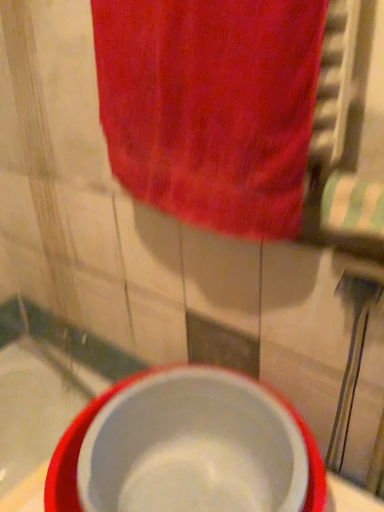
Question: Considering the relative sizes of white plastic basin at center and white glossy bath at lower left in the image provided, is white plastic basin at center thinner than white glossy bath at lower left?

Choices:
 (A) no
 (B) yes

Answer: (A)

Question: From the image's perspective, is white plastic basin at center below white glossy bath at lower left?

Choices:
 (A) yes
 (B) no

Answer: (A)

Question: From a real-world perspective, is white plastic basin at center physically above white glossy bath at lower left?

Choices:
 (A) yes
 (B) no

Answer: (A)

Question: Can you confirm if white plastic basin at center is positioned to the left of white glossy bath at lower left?

Choices:
 (A) yes
 (B) no

Answer: (B)

Question: Is white plastic basin at center wider than white glossy bath at lower left?

Choices:
 (A) no
 (B) yes

Answer: (B)

Question: From a real-world perspective, relative to red cotton towel at upper center, is white plastic basin at center vertically above or below?

Choices:
 (A) below
 (B) above

Answer: (A)

Question: From the image's perspective, is white plastic basin at center positioned above or below red cotton towel at upper center?

Choices:
 (A) above
 (B) below

Answer: (B)

Question: Is point (x=52, y=481) closer or farther from the camera than point (x=240, y=131)?

Choices:
 (A) farther
 (B) closer

Answer: (A)

Question: Is white plastic basin at center bigger or smaller than red cotton towel at upper center?

Choices:
 (A) small
 (B) big

Answer: (B)

Question: Considering the positions of point (193, 488) and point (127, 353), is point (193, 488) closer or farther from the camera than point (127, 353)?

Choices:
 (A) closer
 (B) farther

Answer: (A)

Question: In terms of height, does white plastic basin at center look taller or shorter compared to white glossy bath at lower left?

Choices:
 (A) tall
 (B) short

Answer: (A)

Question: Relative to white glossy bath at lower left, is white plastic basin at center in front or behind?

Choices:
 (A) behind
 (B) front

Answer: (B)

Question: From the image's perspective, is white plastic basin at center positioned above or below white glossy bath at lower left?

Choices:
 (A) below
 (B) above

Answer: (A)

Question: From the image's perspective, is red cotton towel at upper center positioned above or below white glossy bath at lower left?

Choices:
 (A) above
 (B) below

Answer: (A)

Question: Looking at their shapes, would you say red cotton towel at upper center is wider or thinner than white glossy bath at lower left?

Choices:
 (A) thin
 (B) wide

Answer: (A)